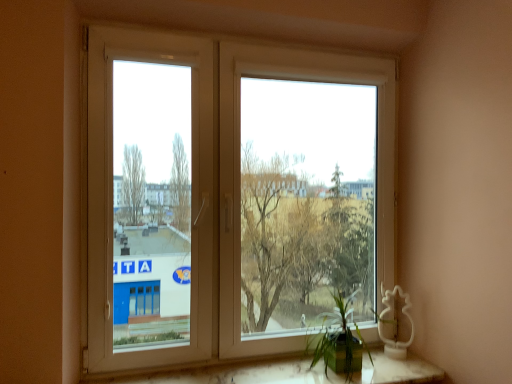
I want to click on vacant space situated above white plastic window at center (from a real-world perspective), so click(311, 49).